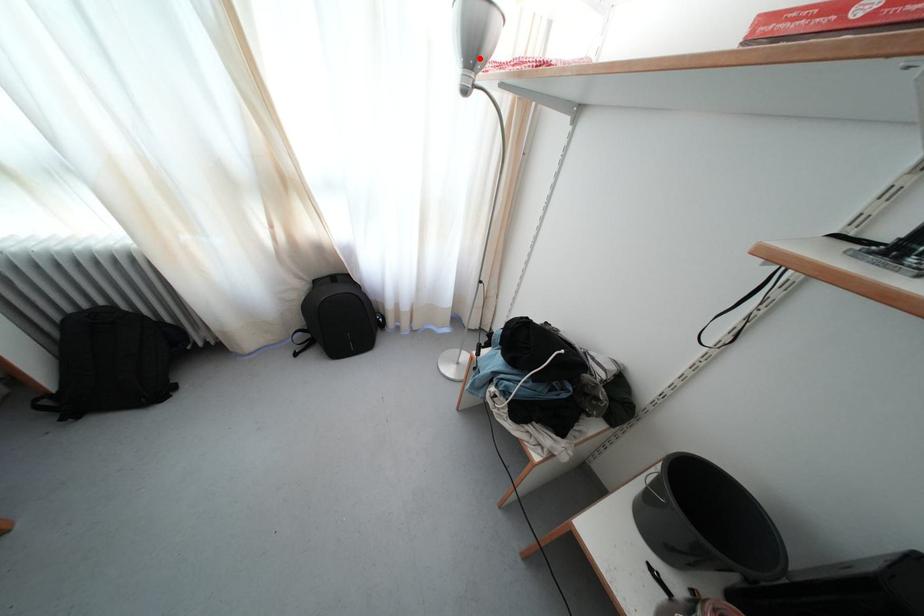
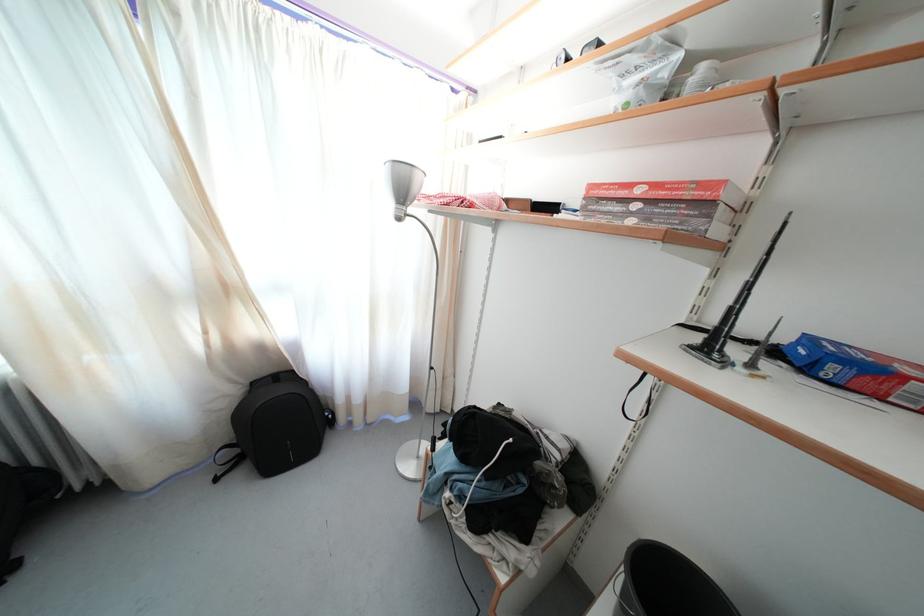
Find the pixel in the second image that matches the highlighted location in the first image.

(408, 199)